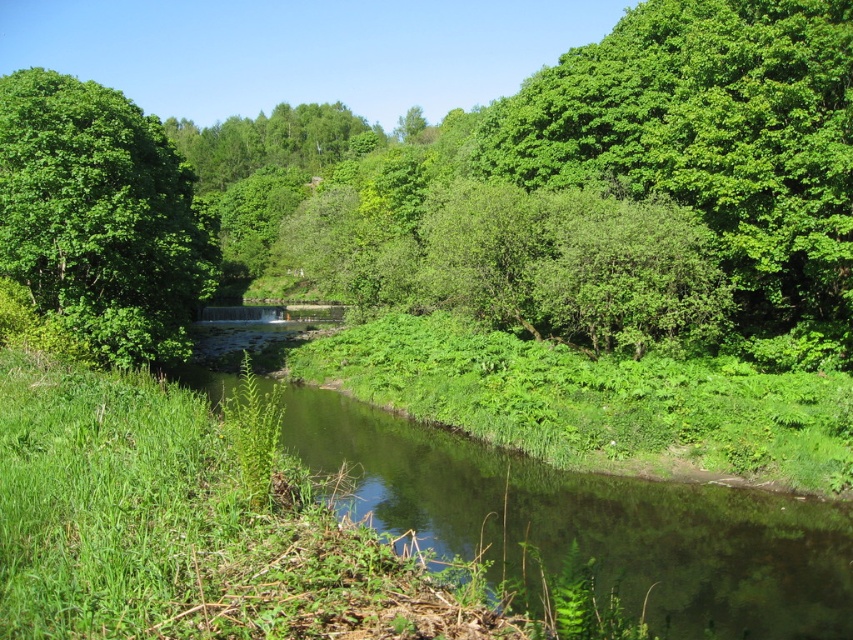
Question: Which point is farther to the camera?

Choices:
 (A) green leafy tree at upper left
 (B) clear water at center

Answer: (A)

Question: Does clear water at center appear under green leafy tree at upper left?

Choices:
 (A) no
 (B) yes

Answer: (B)

Question: Which object is closer to the camera taking this photo?

Choices:
 (A) clear water at center
 (B) green leafy tree at upper left

Answer: (A)

Question: From the image, what is the correct spatial relationship of clear water at center in relation to green leafy tree at upper left?

Choices:
 (A) right
 (B) left

Answer: (A)

Question: In this image, where is clear water at center located relative to green leafy tree at upper left?

Choices:
 (A) below
 (B) above

Answer: (A)